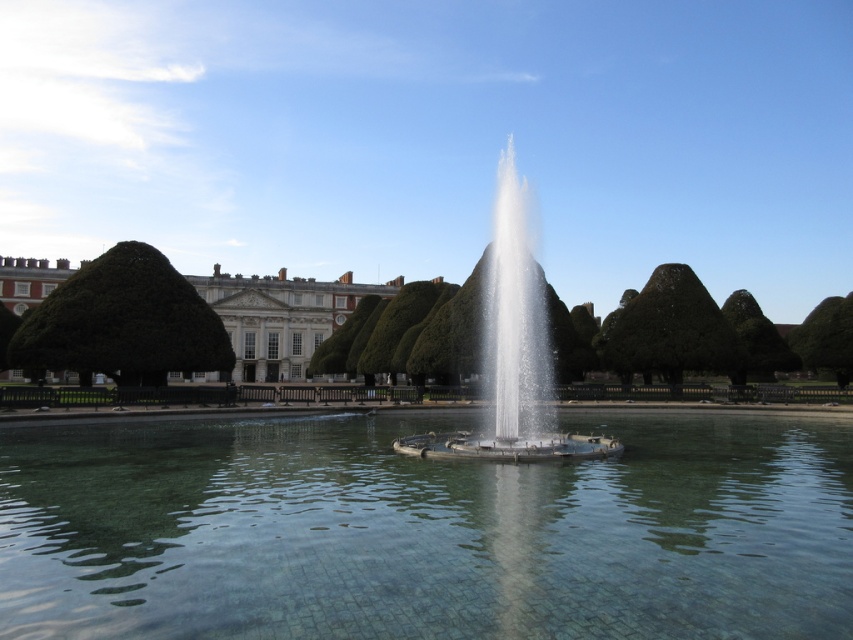
Between green leafy tree at left and green leafy tree at right, which one is positioned higher?

green leafy tree at left

Who is lower down, green leafy tree at left or green leafy tree at right?

green leafy tree at right

Between point (138, 371) and point (755, 358), which one is positioned behind?

Point (755, 358)

Locate an element on the screen. green leafy tree at left is located at coordinates (122, 323).

From the picture: Who is positioned more to the right, clear glass water at center or green leafy tree at left?

clear glass water at center

I want to click on clear glass water at center, so click(x=424, y=531).

Is point (376, 636) closer to viewer compared to point (135, 289)?

Yes, it is.

The width and height of the screenshot is (853, 640). In order to click on clear glass water at center in this screenshot , I will do `click(424, 531)`.

Does green textured hedge at upper right appear on the right side of green leafy tree at upper right?

No, green textured hedge at upper right is not to the right of green leafy tree at upper right.

Is point (666, 310) farther from camera compared to point (827, 296)?

No, (666, 310) is in front of (827, 296).

Between point (665, 304) and point (809, 339), which one is positioned in front?

Point (665, 304) is more forward.

Locate an element on the screen. This screenshot has height=640, width=853. green textured hedge at upper right is located at coordinates (668, 330).